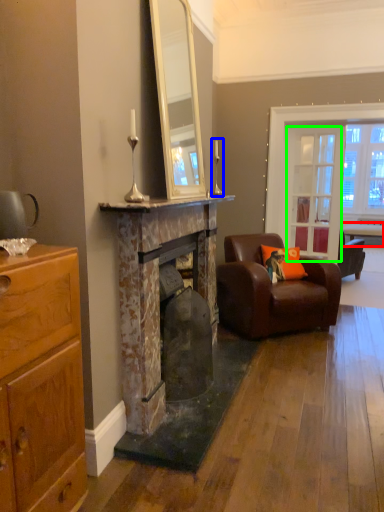
Question: Which object is positioned closest to table (highlighted by a red box)? Select from table lamp (highlighted by a blue box) and glass door (highlighted by a green box).

Choices:
 (A) table lamp
 (B) glass door

Answer: (B)